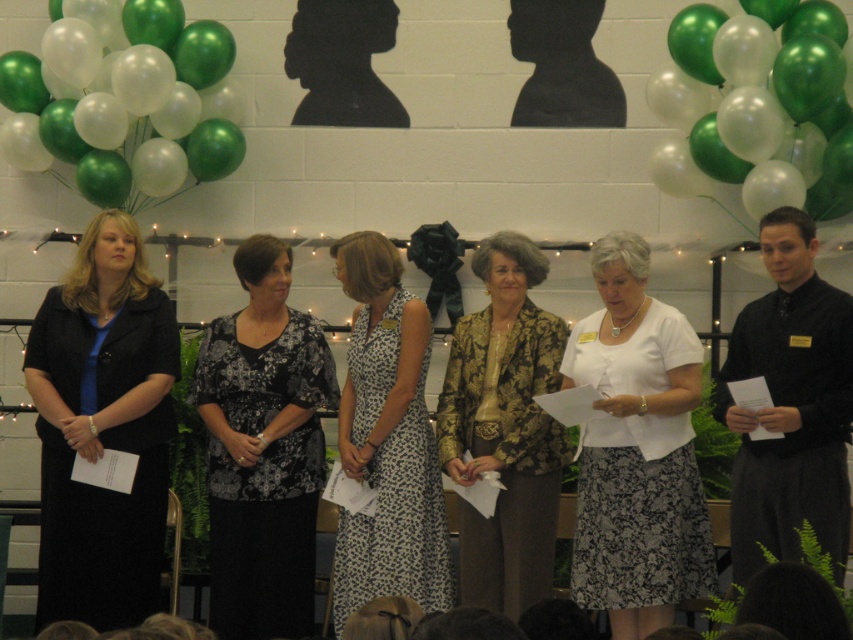
Is black printed blouse at center to the left of white dotted dress at center from the viewer's perspective?

Yes, black printed blouse at center is to the left of white dotted dress at center.

Is black printed blouse at center bigger than white dotted dress at center?

No, black printed blouse at center is not bigger than white dotted dress at center.

Locate an element on the screen. black printed blouse at center is located at coordinates (263, 449).

Where is `black printed blouse at center`? black printed blouse at center is located at coordinates (263, 449).

Between point (606, 464) and point (48, 44), which one is positioned in front?

Positioned in front is point (606, 464).

Is white matte dress at center behind green metallic balloons at upper left?

No, it is in front of green metallic balloons at upper left.

This screenshot has height=640, width=853. Describe the element at coordinates (637, 451) in the screenshot. I see `white matte dress at center` at that location.

Identify the location of white matte dress at center. This screenshot has height=640, width=853. (637, 451).

Describe the element at coordinates (102, 428) in the screenshot. This screenshot has height=640, width=853. I see `matte black dress at left` at that location.

How far apart are matte black dress at left and green metallic balloons at upper left?

3.69 feet

Is point (68, 445) positioned before point (114, 99)?

Yes.

What are the coordinates of `matte black dress at left` in the screenshot? It's located at (102, 428).